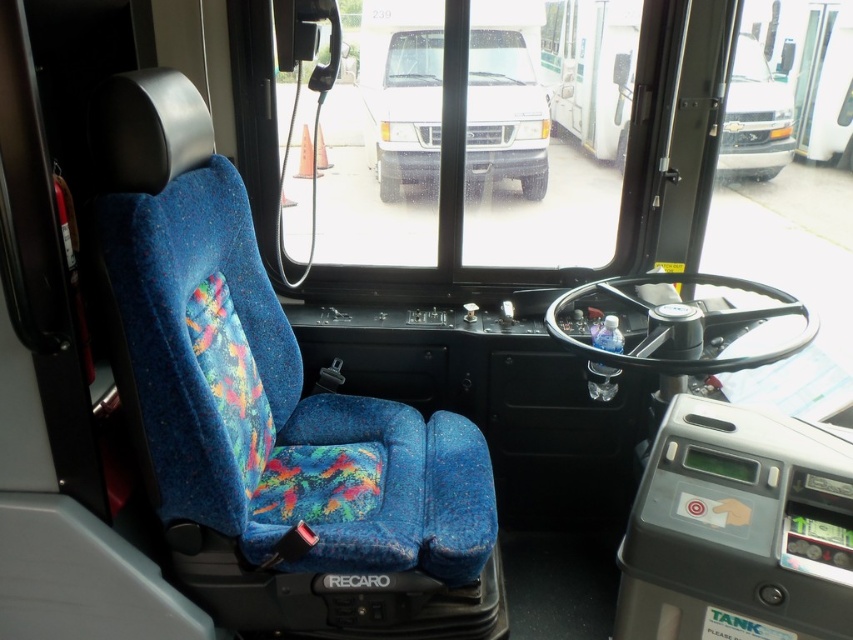
You are a passenger in the vehicle and want to see the road ahead. Which object, the transparent glass window at center or the matte black van at upper center, would allow you to see further ahead?

The transparent glass window at center is taller than the matte black van at upper center, so it would allow you to see further ahead.

You are a passenger in the bus and want to look outside through the transparent glass window at center. Where should you look relative to the driver seat?

The transparent glass window at center is located at point 0.217 on the x axis and 0.635 on the y axis relative to the driver seat.